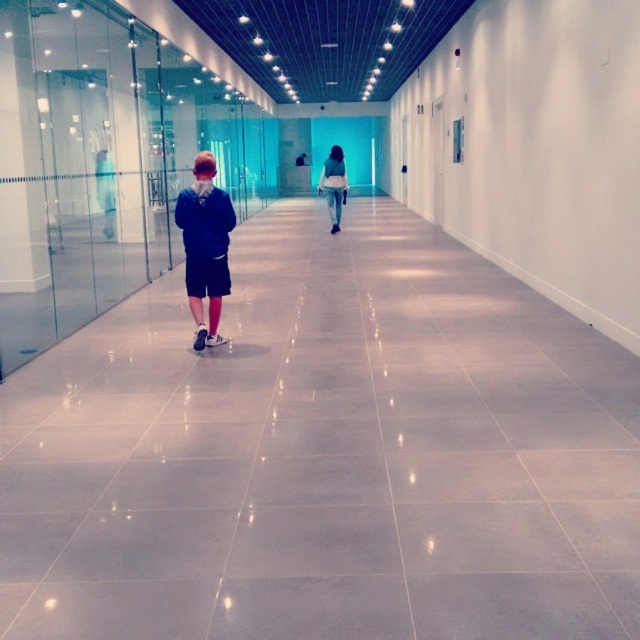
Is gray tile floor at center to the right of matte blue hoodie at center from the viewer's perspective?

Correct, you'll find gray tile floor at center to the right of matte blue hoodie at center.

Is gray tile floor at center thinner than matte blue hoodie at center?

No, gray tile floor at center is not thinner than matte blue hoodie at center.

Is point (593, 384) positioned after point (212, 188)?

That is False.

You are a GUI agent. You are given a task and a screenshot of the screen. Output one action in this format:
    pyautogui.click(x=<x>, y=<y>)
    Task: Click on the gray tile floor at center
    Image resolution: width=640 pixels, height=640 pixels.
    Given the screenshot: What is the action you would take?
    pyautogui.click(x=326, y=454)

Which is more to the left, matte blue hoodie at center or white cotton shirt at center?

Positioned to the left is matte blue hoodie at center.

What do you see at coordinates (205, 246) in the screenshot? The height and width of the screenshot is (640, 640). I see `matte blue hoodie at center` at bounding box center [205, 246].

This screenshot has width=640, height=640. I want to click on matte blue hoodie at center, so click(x=205, y=246).

Who is higher up, gray tile floor at center or white cotton shirt at center?

white cotton shirt at center is above.

Locate an element on the screen. This screenshot has width=640, height=640. gray tile floor at center is located at coordinates (326, 454).

Does point (444, 429) come farther from viewer compared to point (336, 164)?

No, it is in front of (336, 164).

I want to click on gray tile floor at center, so click(326, 454).